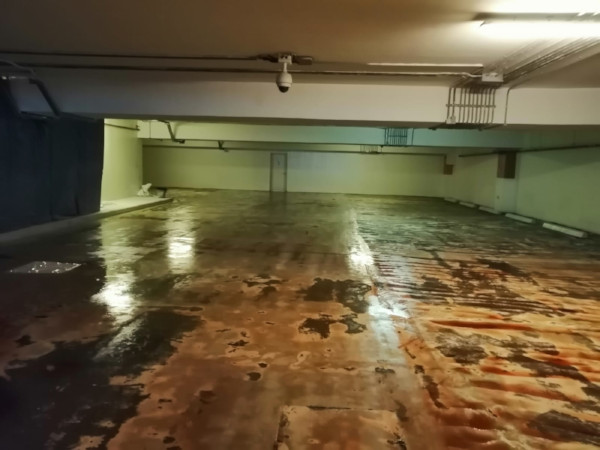
Where is `gray spots on the floor`? gray spots on the floor is located at coordinates (69, 377), (336, 286), (452, 290), (485, 265), (545, 372), (561, 425), (139, 277), (164, 224).